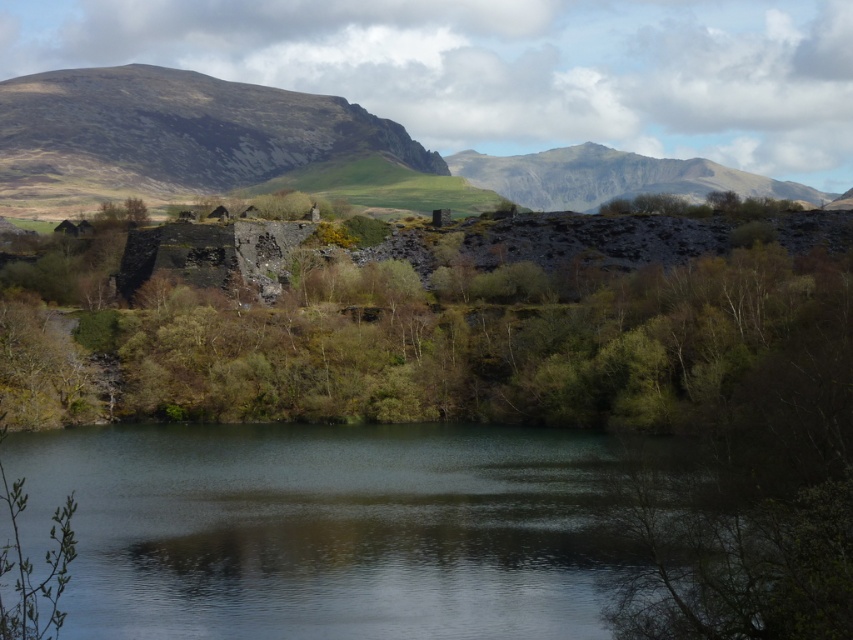
You are standing at the point with coordinates (415, 348) in the serene landscape. What object is located exactly at your current position?

The green leafy tree at center is located exactly at the point with coordinates (415, 348).

You are an environmental planner assessing the landscape. You need to determine which object occupies more space in the scene for a vegetation study. Which is larger in size between the green leafy tree at center and the smooth gray rock at upper center?

The smooth gray rock at upper center is larger than the green leafy tree at center, so it occupies more space in the scene.